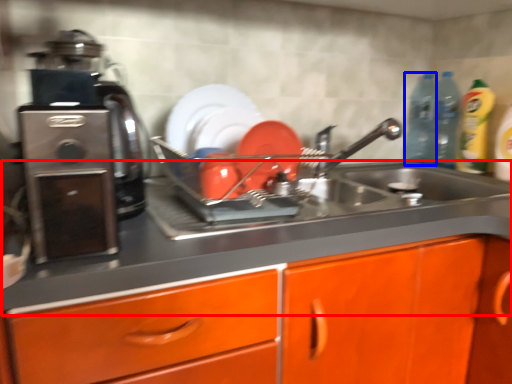
Question: Which of the following is the farthest to the observer, counter top (highlighted by a red box) or bottle (highlighted by a blue box)?

Choices:
 (A) counter top
 (B) bottle

Answer: (B)